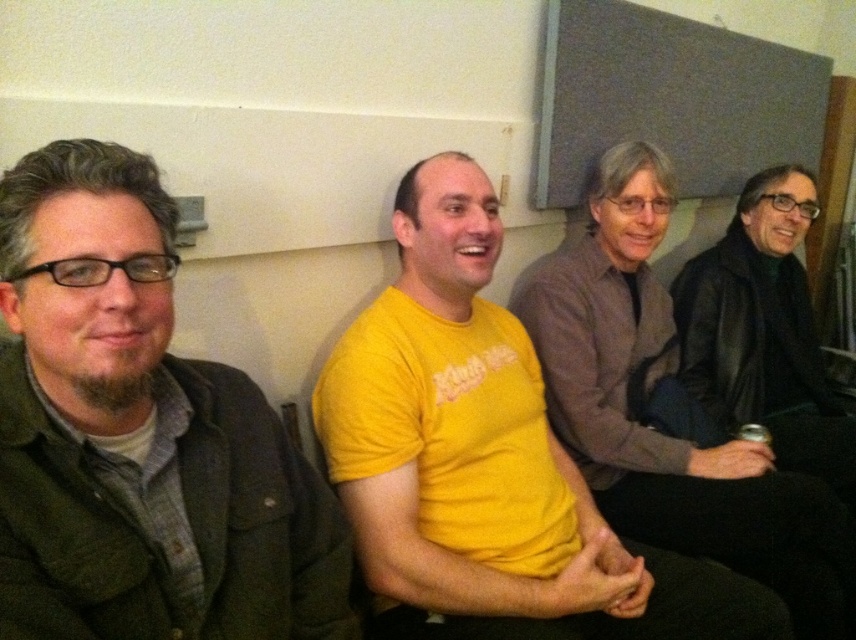
From the picture: You are standing in the room and need to locate the matte black jacket at left. According to the coordinates provided, where exactly would you find it?

The matte black jacket at left is located at point coordinates 0.683 in the x axis and 0.164 in the y axis.

Based on the coordinates provided in the scene, which object corresponds to the point labeled as point (140, 436)?

The point (140, 436) corresponds to the matte black jacket at left.